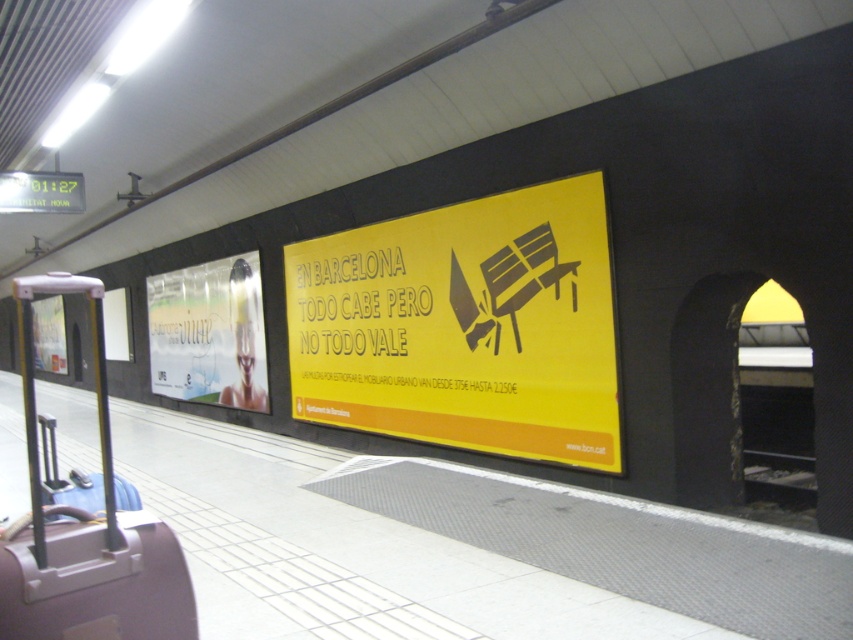
You are at the subway station and need to place a new poster between the yellow paper sign at center and the purple matte suitcase at left. Where should you place it so it is between them?

The yellow paper sign at center is to the right of the purple matte suitcase at left, so placing the new poster between them would require positioning it to the right of the purple matte suitcase at left and to the left of the yellow paper sign at center.

You are standing on a subway platform and need to locate the yellow paper sign at center. According to the scene description, where should you look relative to the large yellow advertisement?

The yellow paper sign at center is located to the left of the large yellow advertisement.

You are a commuter waiting for the train at the subway platform. You notice the yellow paper sign at center and the metallic glossy poster at left. Which object is taller?

The yellow paper sign at center is much taller than the metallic glossy poster at left.